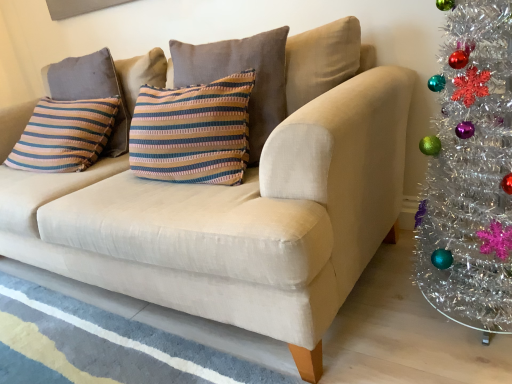
Question: Should I look upward or downward to see striped fabric pillow at center, the 2th pillow viewed from the back?

Choices:
 (A) up
 (B) down

Answer: (A)

Question: From the image's perspective, is striped fabric pillow at upper left, marked as the 1th pillow in a left-to-right arrangement, beneath striped fabric pillow at center, the 2th pillow in the left-to-right sequence?

Choices:
 (A) no
 (B) yes

Answer: (A)

Question: From a real-world perspective, is striped fabric pillow at upper left, the second pillow positioned from the front, below striped fabric pillow at center, which appears as the first pillow when viewed from the right?

Choices:
 (A) yes
 (B) no

Answer: (A)

Question: Is striped fabric pillow at upper left, marked as the 1th pillow in a left-to-right arrangement, thinner than striped fabric pillow at center, which appears as the first pillow when viewed from the right?

Choices:
 (A) no
 (B) yes

Answer: (B)

Question: Is striped fabric pillow at upper left, the 2th pillow positioned from the right, in contact with striped fabric pillow at center, the 2th pillow in the left-to-right sequence?

Choices:
 (A) no
 (B) yes

Answer: (A)

Question: From the image's perspective, does striped fabric pillow at upper left, the 1th pillow viewed from the back, appear higher than striped fabric pillow at center, which appears as the first pillow when viewed from the right?

Choices:
 (A) no
 (B) yes

Answer: (B)

Question: Considering the relative sizes of striped fabric pillow at upper left, marked as the 1th pillow in a left-to-right arrangement, and striped fabric pillow at center, the first pillow from the front, in the image provided, is striped fabric pillow at upper left, marked as the 1th pillow in a left-to-right arrangement, taller than striped fabric pillow at center, the first pillow from the front,?

Choices:
 (A) yes
 (B) no

Answer: (B)

Question: Is striped fabric pillow at center, the 2th pillow viewed from the back, smaller than striped fabric pillow at upper left, the 2th pillow positioned from the right?

Choices:
 (A) yes
 (B) no

Answer: (B)

Question: From a real-world perspective, is striped fabric pillow at center, the first pillow from the front, under striped fabric pillow at upper left, the second pillow positioned from the front?

Choices:
 (A) yes
 (B) no

Answer: (B)

Question: Is striped fabric pillow at upper left, marked as the 1th pillow in a left-to-right arrangement, surrounded by striped fabric pillow at center, the first pillow from the front?

Choices:
 (A) yes
 (B) no

Answer: (B)

Question: Is striped fabric pillow at center, the 2th pillow viewed from the back, far away from striped fabric pillow at upper left, the 2th pillow positioned from the right?

Choices:
 (A) no
 (B) yes

Answer: (A)

Question: Is striped fabric pillow at center, the first pillow from the front, outside striped fabric pillow at upper left, the 1th pillow viewed from the back?

Choices:
 (A) yes
 (B) no

Answer: (A)

Question: Is striped fabric pillow at center, the 2th pillow viewed from the back, taller than striped fabric pillow at upper left, the 2th pillow positioned from the right?

Choices:
 (A) no
 (B) yes

Answer: (B)

Question: From the image's perspective, is striped fabric pillow at upper left, the second pillow positioned from the front, positioned above or below striped fabric pillow at center, the 2th pillow in the left-to-right sequence?

Choices:
 (A) above
 (B) below

Answer: (A)